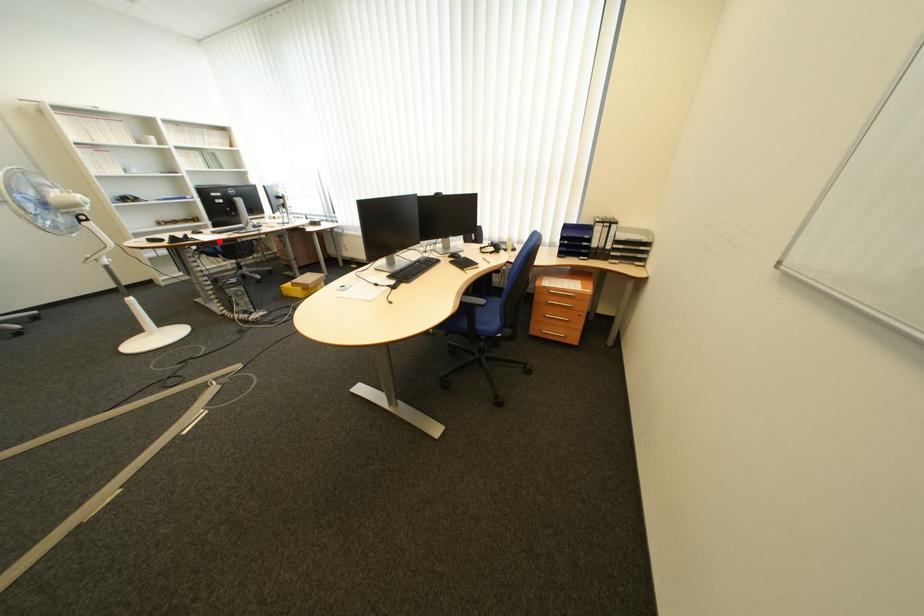
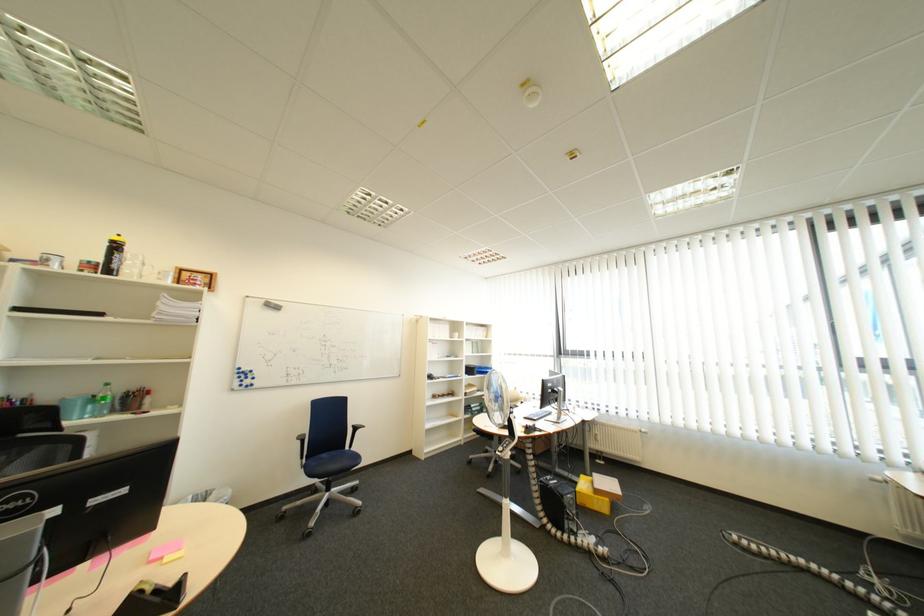
Question: I am providing you with two images of the same scene from different viewpoints. Given a red point in image1, look at the same physical point in image2. Is it:

Choices:
 (A) Closer to the viewpoint
 (B) Farther from the viewpoint

Answer: (B)